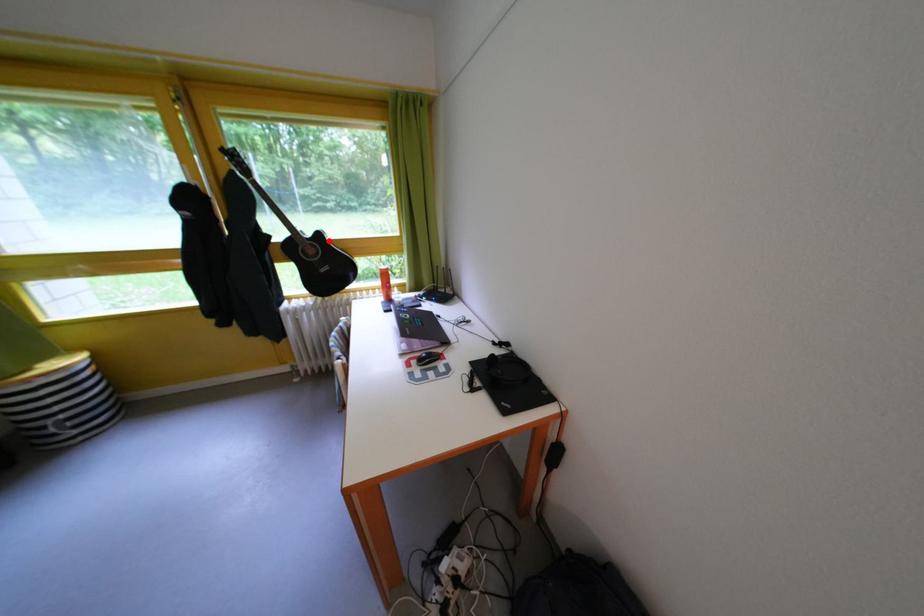
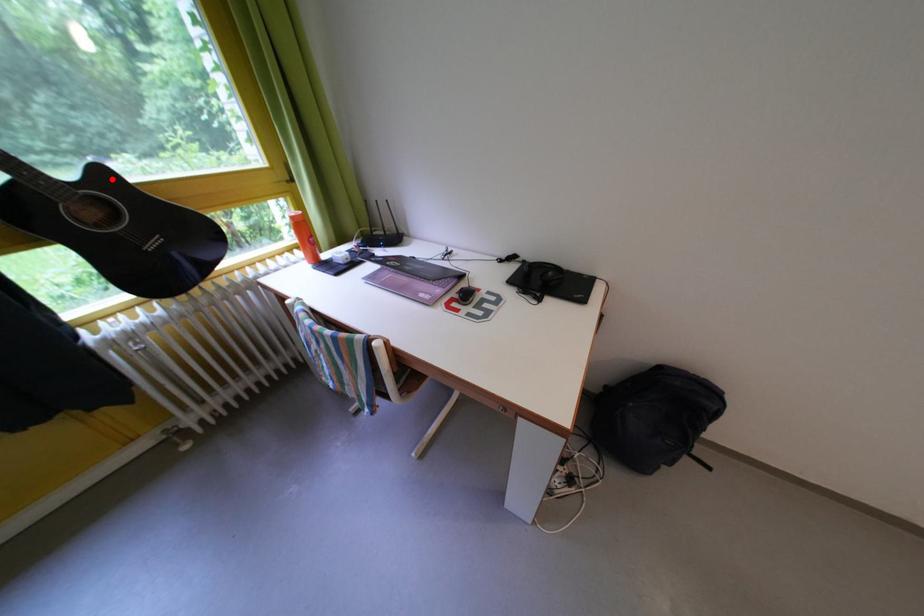
I am providing you with two images of the same scene from different viewpoints. A red point is marked on the first image and another point is marked on the second image. Does the point marked in image1 correspond to the same location as the one in image2?

Yes